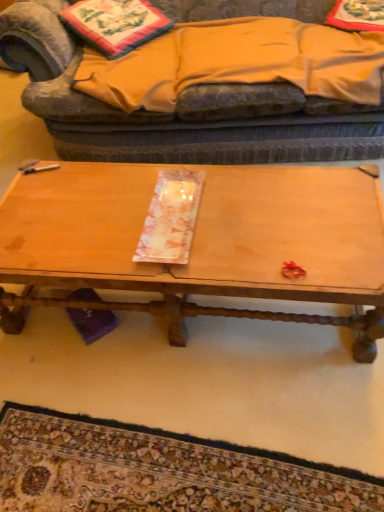
Question: Looking at their shapes, would you say wooden tray at center is wider or thinner than carpet with intricate patterns at lower center?

Choices:
 (A) wide
 (B) thin

Answer: (A)

Question: Is wooden tray at center bigger or smaller than carpet with intricate patterns at lower center?

Choices:
 (A) big
 (B) small

Answer: (A)

Question: Which of these objects is positioned closest to the embroidered fabric pillow at upper left?

Choices:
 (A) carpet with intricate patterns at lower center
 (B) orange cotton blanket at upper center
 (C) wooden tray at center
 (D) velvet fabric studio couch at upper center

Answer: (B)

Question: Estimate the real-world distances between objects in this image. Which object is farther from the orange cotton blanket at upper center?

Choices:
 (A) carpet with intricate patterns at lower center
 (B) embroidered fabric pillow at upper left
 (C) wooden tray at center
 (D) velvet fabric studio couch at upper center

Answer: (A)